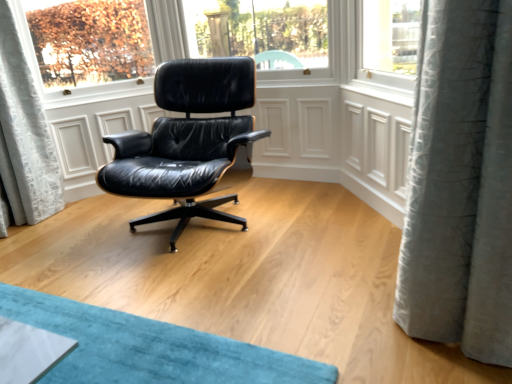
Question: From a real-world perspective, is black leather chair at center positioned over gray textured curtain at right based on gravity?

Choices:
 (A) no
 (B) yes

Answer: (A)

Question: Can you confirm if black leather chair at center is positioned to the left of gray textured curtain at right?

Choices:
 (A) no
 (B) yes

Answer: (B)

Question: From the image's perspective, is black leather chair at center on top of gray textured curtain at right?

Choices:
 (A) yes
 (B) no

Answer: (A)

Question: Is black leather chair at center further to the viewer compared to gray textured curtain at right?

Choices:
 (A) yes
 (B) no

Answer: (A)

Question: Considering the relative sizes of black leather chair at center and gray textured curtain at right in the image provided, is black leather chair at center wider than gray textured curtain at right?

Choices:
 (A) yes
 (B) no

Answer: (A)

Question: Is black leather chair at center placed right next to gray textured curtain at right?

Choices:
 (A) no
 (B) yes

Answer: (A)

Question: Is gray textured curtain at right next to black leather chair at center?

Choices:
 (A) no
 (B) yes

Answer: (A)

Question: Does gray textured curtain at right lie in front of black leather chair at center?

Choices:
 (A) yes
 (B) no

Answer: (A)

Question: Is gray textured curtain at right to the right of black leather chair at center from the viewer's perspective?

Choices:
 (A) yes
 (B) no

Answer: (A)

Question: Does gray textured curtain at right contain black leather chair at center?

Choices:
 (A) yes
 (B) no

Answer: (B)

Question: Does gray textured curtain at right have a greater width compared to black leather chair at center?

Choices:
 (A) no
 (B) yes

Answer: (A)

Question: From the image's perspective, is gray textured curtain at right on black leather chair at center?

Choices:
 (A) yes
 (B) no

Answer: (B)

Question: Based on their positions, is black leather chair at center located to the left or right of gray textured curtain at right?

Choices:
 (A) right
 (B) left

Answer: (B)